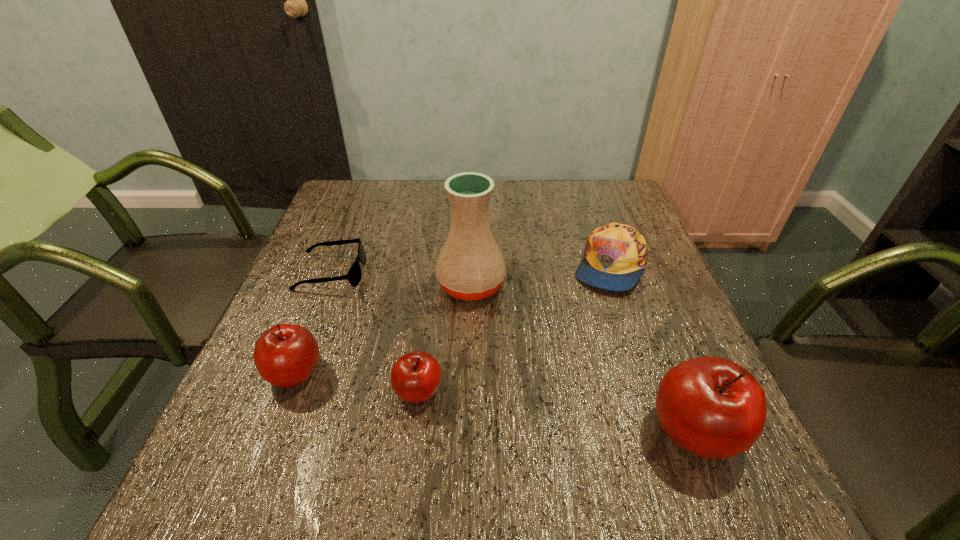
This screenshot has height=540, width=960. I want to click on location for an additional apple to make spacing equal, so click(551, 410).